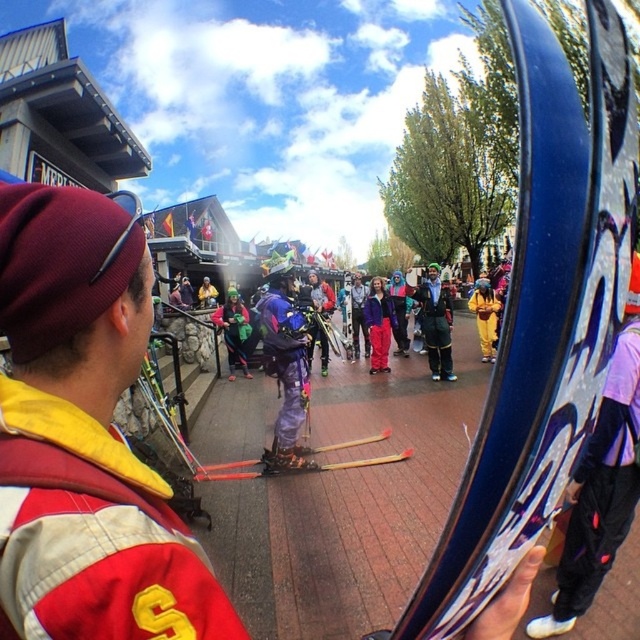
You are standing at point (300, 316) and want to take a photo of the group of people in the central part of the image. The camera you have can focus on subjects within 4 meters. Will you be able to capture the group clearly?

The distance between point (300, 316) and the camera is 3.99 meters, which is within the camera focus range of 4 meters. Therefore, the group can be captured clearly.

From the picture: You are a photographer trying to capture a group photo of the shiny metallic jacket at center and yellow fabric pants at center. Your camera has a minimum focus distance of 4 feet. Can you take a photo of both subjects without moving them?

The distance between the shiny metallic jacket at center and yellow fabric pants at center is 3.93 feet, which is less than the camera minimum focus distance of 4 feet. Therefore, you can take a photo of both subjects without moving them.

In the scene, you see a shiny metallic jacket at center and a matte purple jacket at center. Which one is positioned to the right of the other?

The shiny metallic jacket at center is to the right of the matte purple jacket at center.